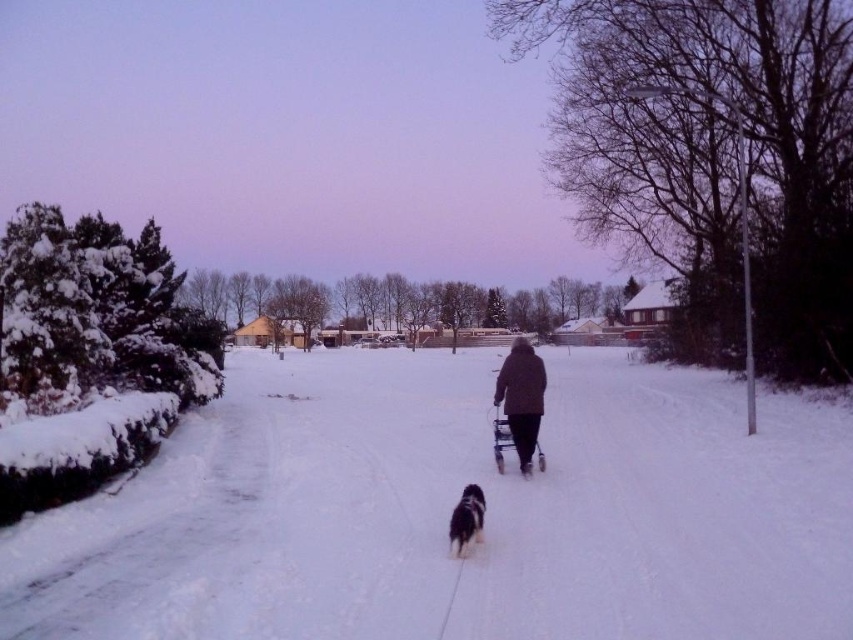
You are standing at the edge of the snow path and want to place a small decorative snowman exactly where the white fluffy snow at center is. According to the coordinates provided, where should you place the snowman?

The white fluffy snow at center is located at point (450, 512), so you should place the snowman there.

In the scene shown: You are standing on the snow path and see the brown woolen coat at center and the fluffy black dog at center. Which one is closer to you?

The brown woolen coat at center is closer to you because the fluffy black dog at center is behind it.